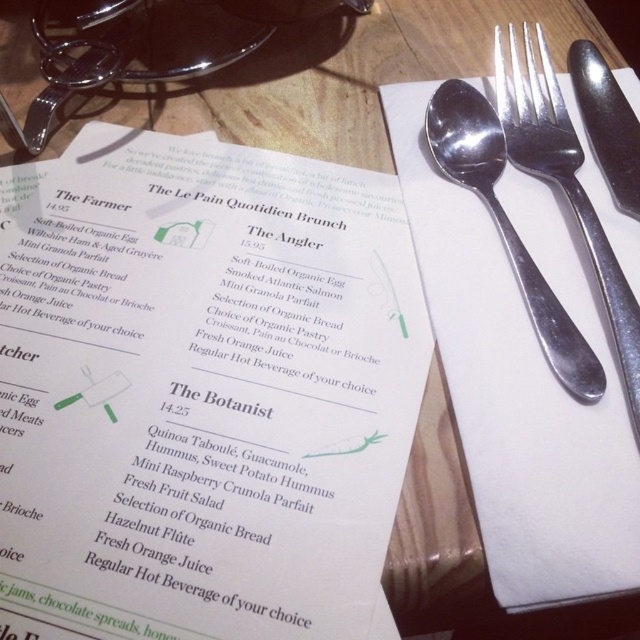
You are a customer at The Le Pain Quotidien Brunch. You notice the polished silver fork at upper right and the polished metal knife at right. Which utensil is placed lower on the table?

The polished silver fork at upper right is positioned under the polished metal knife at right, so the fork is placed lower on the table.

You are a food delivery robot standing at the camera position. You need to pick up the menu from the table. The robot has an arm that can reach up to 10 inches. Can you safely reach the menu located at point (x=620, y=378)?

The distance between point (x=620, y=378) and the camera is 10.76 inches. Since the robot arm can only reach up to 10 inches, it cannot safely reach the menu at point (x=620, y=378).